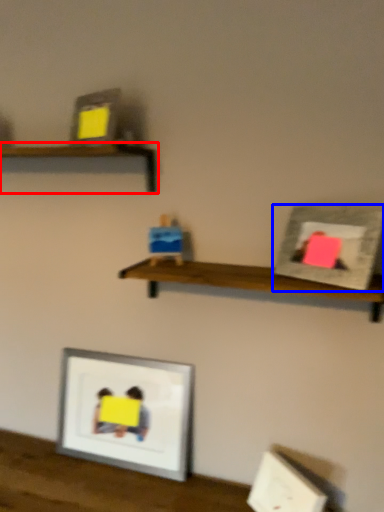
Question: Which object appears farthest to the camera in this image, shelf (highlighted by a red box) or picture frame (highlighted by a blue box)?

Choices:
 (A) shelf
 (B) picture frame

Answer: (A)